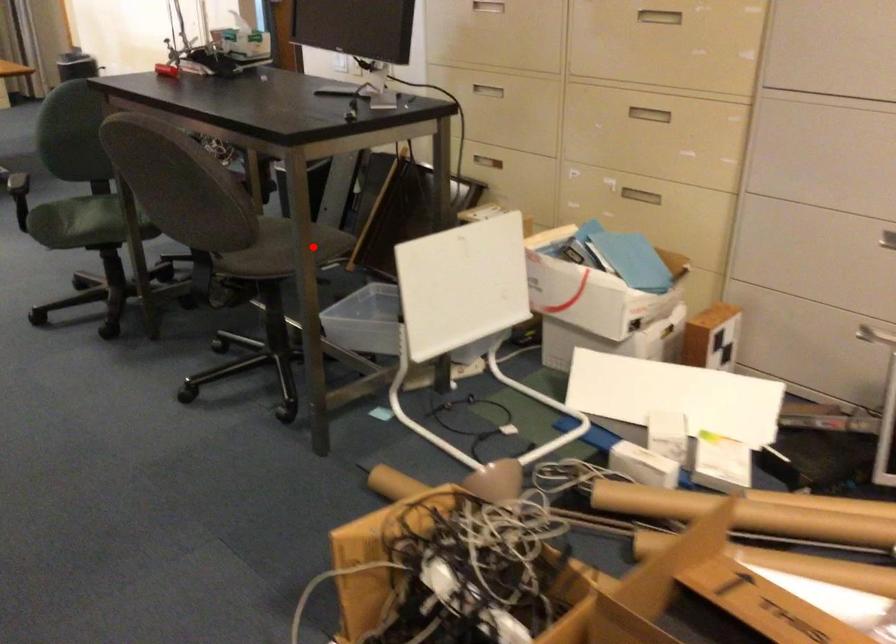
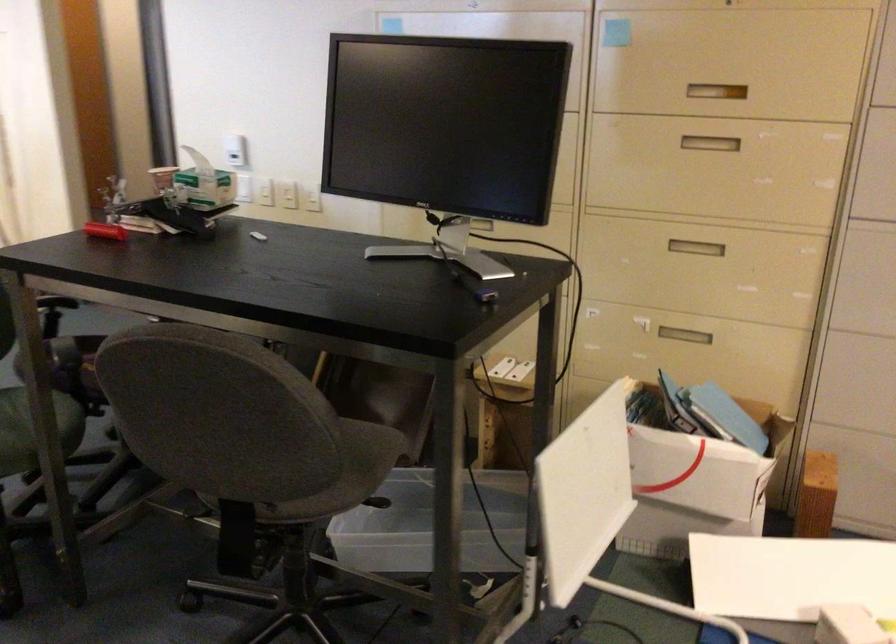
Question: I am providing you with two images of the same scene from different viewpoints. In image1, a red point is highlighted. Considering the same 3D point in image2, which of the following is correct?

Choices:
 (A) It is closer
 (B) It is farther

Answer: (A)